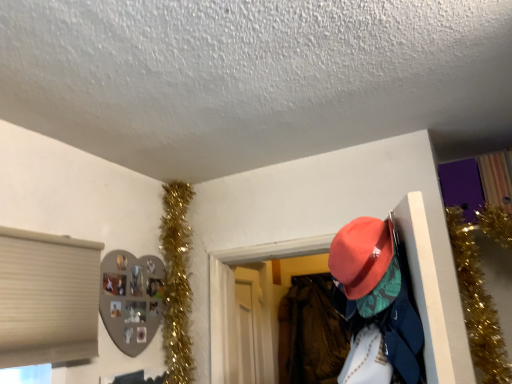
Question: From the image's perspective, is gold tinsel garland at upper left positioned above or below matte orange hat at upper right?

Choices:
 (A) below
 (B) above

Answer: (A)

Question: Is gold tinsel garland at upper left spatially inside matte orange hat at upper right, or outside of it?

Choices:
 (A) inside
 (B) outside

Answer: (B)

Question: Which object is positioned closest to the velvet-like orange hat at center-right?

Choices:
 (A) matte orange hat at upper right
 (B) gold tinsel garland at upper left

Answer: (B)

Question: Estimate the real-world distances between objects in this image. Which object is closer to the velvet-like orange hat at center-right?

Choices:
 (A) matte orange hat at upper right
 (B) gold tinsel garland at upper left

Answer: (B)